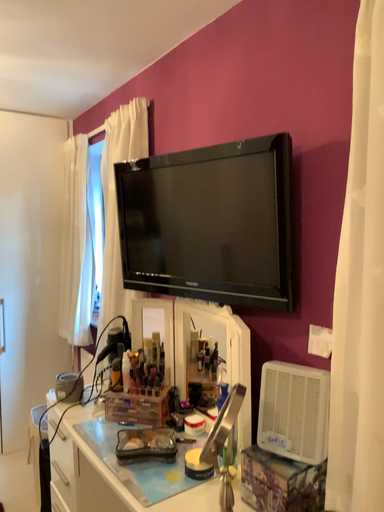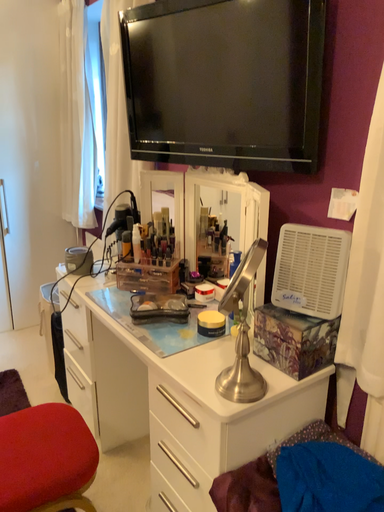
Question: How did the camera likely rotate when shooting the video?

Choices:
 (A) rotated downward
 (B) rotated upward

Answer: (A)